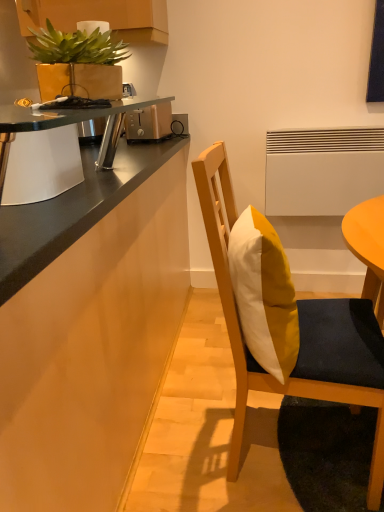
Question: Is metallic silver desk at upper left positioned behind yellow matte pillow at center?

Choices:
 (A) yes
 (B) no

Answer: (B)

Question: Is metallic silver desk at upper left to the left of yellow matte pillow at center from the viewer's perspective?

Choices:
 (A) no
 (B) yes

Answer: (B)

Question: Is metallic silver desk at upper left located outside yellow matte pillow at center?

Choices:
 (A) yes
 (B) no

Answer: (A)

Question: Does metallic silver desk at upper left have a lesser width compared to yellow matte pillow at center?

Choices:
 (A) yes
 (B) no

Answer: (A)

Question: Is metallic silver desk at upper left bigger than yellow matte pillow at center?

Choices:
 (A) no
 (B) yes

Answer: (B)

Question: Would you say matte gold pot at upper left is inside or outside matte wood cabinetry at left?

Choices:
 (A) outside
 (B) inside

Answer: (A)

Question: Considering the positions of matte gold pot at upper left and matte wood cabinetry at left in the image, is matte gold pot at upper left taller or shorter than matte wood cabinetry at left?

Choices:
 (A) short
 (B) tall

Answer: (A)

Question: Based on their sizes in the image, would you say matte gold pot at upper left is bigger or smaller than matte wood cabinetry at left?

Choices:
 (A) big
 (B) small

Answer: (B)

Question: From a real-world perspective, relative to matte wood cabinetry at left, is matte gold pot at upper left vertically above or below?

Choices:
 (A) below
 (B) above

Answer: (B)

Question: Is wooden chair with cushion at center taller or shorter than matte gold pot at upper left?

Choices:
 (A) tall
 (B) short

Answer: (A)

Question: Is wooden chair with cushion at center situated inside matte gold pot at upper left or outside?

Choices:
 (A) inside
 (B) outside

Answer: (B)

Question: From the image's perspective, relative to matte gold pot at upper left, is wooden chair with cushion at center above or below?

Choices:
 (A) below
 (B) above

Answer: (A)

Question: From a real-world perspective, relative to matte gold pot at upper left, is wooden chair with cushion at center vertically above or below?

Choices:
 (A) below
 (B) above

Answer: (A)

Question: In the image, is metallic silver desk at upper left on the left side or the right side of satin gold toaster at upper center?

Choices:
 (A) left
 (B) right

Answer: (A)

Question: From the image's perspective, is metallic silver desk at upper left positioned above or below satin gold toaster at upper center?

Choices:
 (A) above
 (B) below

Answer: (B)